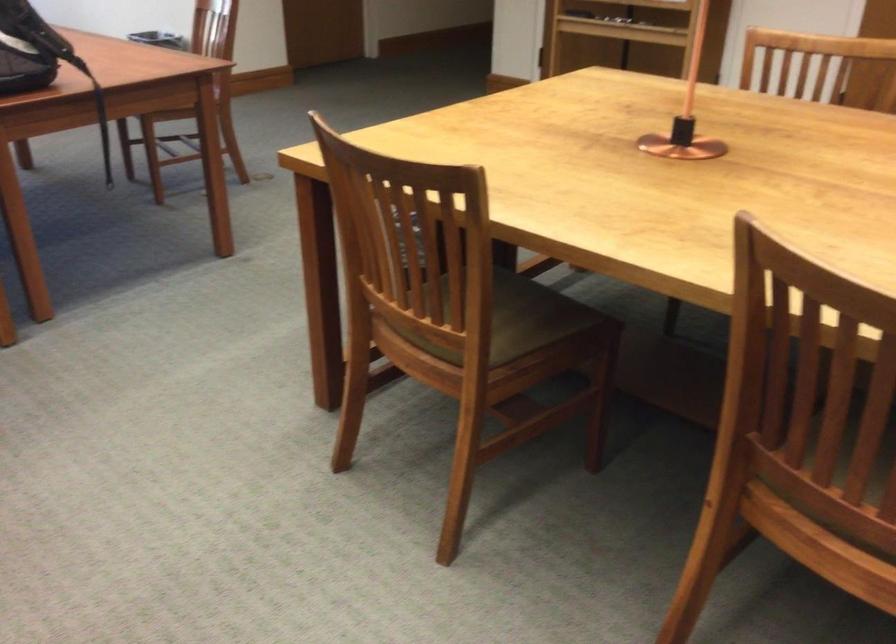
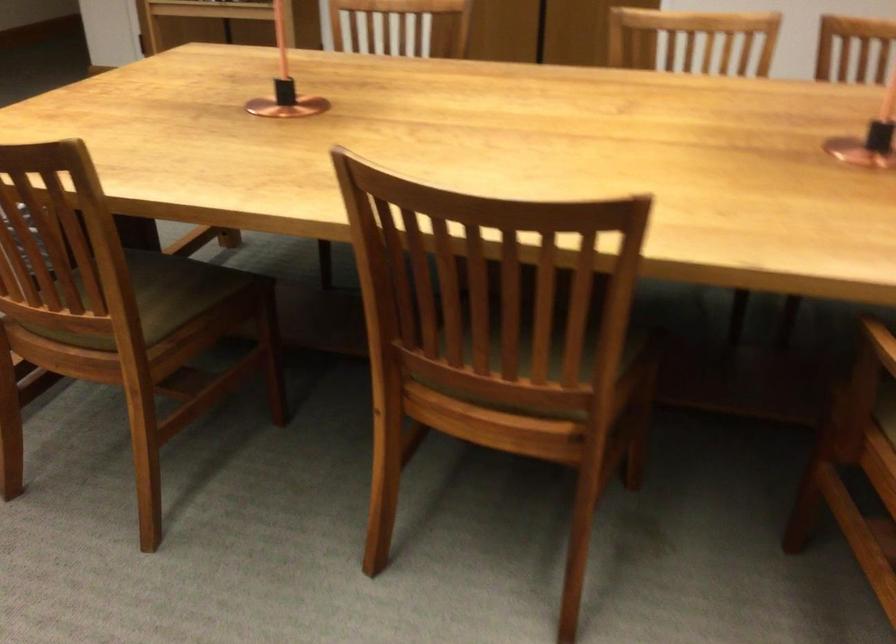
Question: Which direction would the cameraman need to move to produce the second image? Reply with the corresponding letter.

Choices:
 (A) Left
 (B) Right
 (C) Forward
 (D) Backward

Answer: (D)